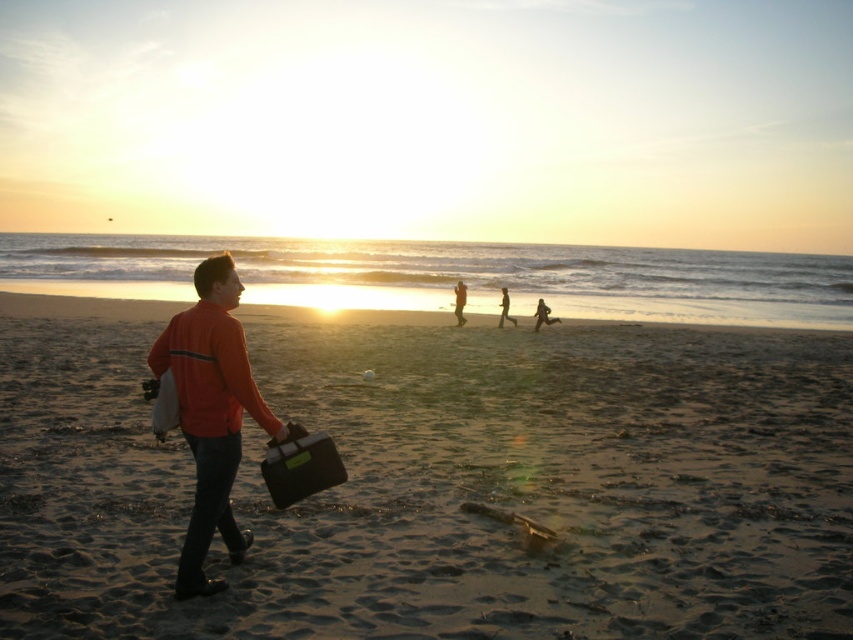
You are standing at the point marked as point (212, 412) on the beach. What object is located exactly at this point?

The orange matte jacket at center is located exactly at point (212, 412).

You are a fashion designer observing the beach scene. You notice the orange matte jacket at center and the orange fabric pants at center. Which of these two items appears taller in the image?

The orange matte jacket at center appears taller than the orange fabric pants at center in the image.